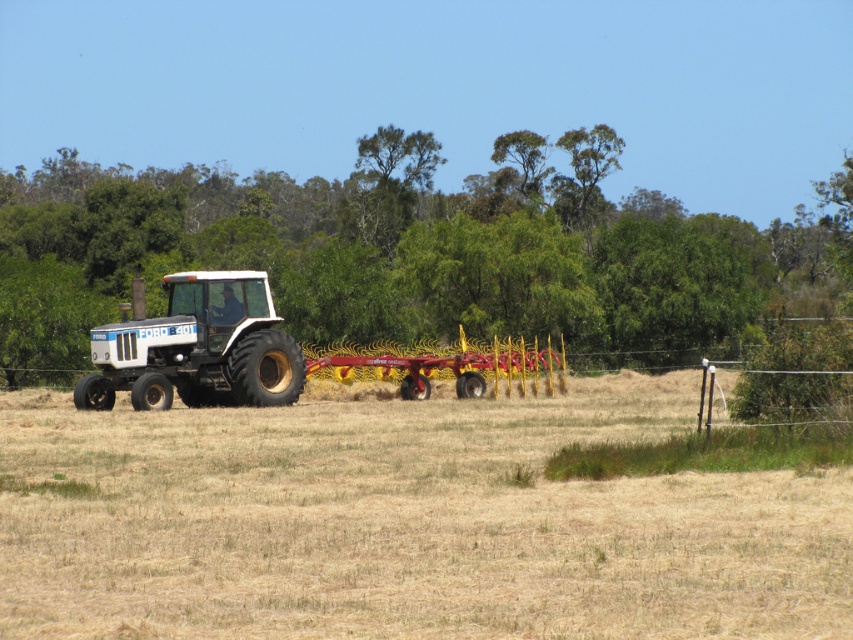
Question: Which of the following is the farthest from the observer?

Choices:
 (A) (358, 452)
 (B) (271, 316)

Answer: (B)

Question: Can you confirm if dry straw at center is positioned to the left of white matte tractor at left?

Choices:
 (A) yes
 (B) no

Answer: (B)

Question: Does white matte tractor at center have a smaller size compared to white matte tractor at left?

Choices:
 (A) yes
 (B) no

Answer: (A)

Question: Which point is farther to the camera?

Choices:
 (A) (x=99, y=508)
 (B) (x=457, y=355)

Answer: (B)

Question: Does dry straw at center appear over white matte tractor at center?

Choices:
 (A) no
 (B) yes

Answer: (A)

Question: Which point appears closest to the camera in this image?

Choices:
 (A) (254, 333)
 (B) (296, 488)

Answer: (B)